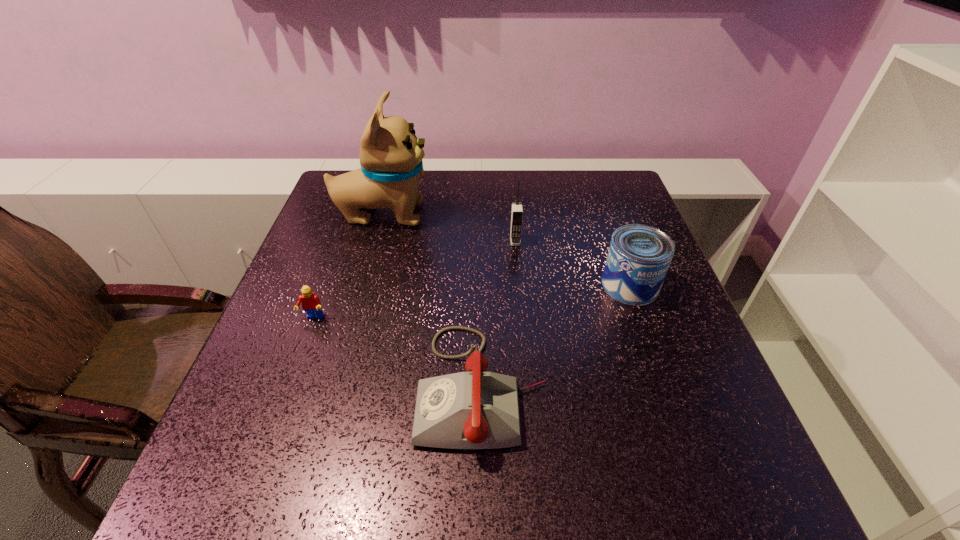
This screenshot has height=540, width=960. Identify the location of vacant area at the far edge. (470, 174).

You are a GUI agent. You are given a task and a screenshot of the screen. Output one action in this format:
    pyautogui.click(x=<x>, y=<y>)
    Task: Click on the vacant region at the near edge of the desktop
    This screenshot has height=540, width=960.
    Given the screenshot: What is the action you would take?
    pyautogui.click(x=308, y=470)

In the image, there is a desktop. What are the coordinates of `vacant area at the left edge` in the screenshot? It's located at (363, 226).

Where is `vacant region at the right edge of the desktop`? This screenshot has height=540, width=960. vacant region at the right edge of the desktop is located at coordinates (663, 334).

I want to click on vacant space at the far right corner of the desktop, so click(598, 190).

This screenshot has width=960, height=540. I want to click on free space at the near right corner of the desktop, so click(x=764, y=477).

This screenshot has width=960, height=540. I want to click on free space between the second nearest object and the nearest object, so click(x=397, y=352).

Locate an element on the screen. The height and width of the screenshot is (540, 960). free space between the rightmost object and the farthest object is located at coordinates (506, 249).

Locate an element on the screen. This screenshot has width=960, height=540. free space between the fourth farthest object and the telephone is located at coordinates click(397, 352).

Image resolution: width=960 pixels, height=540 pixels. Identify the location of free space between the can and the cellular telephone. (572, 263).